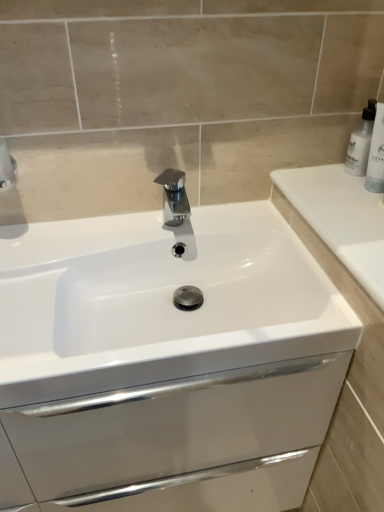
Identify the location of vacant region above white glossy sink at center (from a real-world perspective). (118, 244).